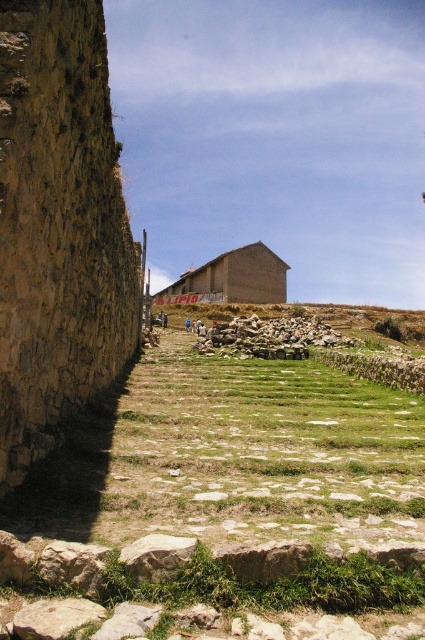
Question: Which object is closer to the camera taking this photo?

Choices:
 (A) brown brick hut at center
 (B) rustic stone wall at center

Answer: (B)

Question: Which object appears farthest from the camera in this image?

Choices:
 (A) brown brick hut at center
 (B) brown rough rock at lower center
 (C) rustic stone wall at center

Answer: (A)

Question: Is brown brick hut at center below rustic stone wall at center?

Choices:
 (A) yes
 (B) no

Answer: (B)

Question: Can you confirm if rustic stone wall at center is positioned to the right of brown rough rock at lower center?

Choices:
 (A) no
 (B) yes

Answer: (B)

Question: Is brown brick hut at center to the left of rustic stone wall at center from the viewer's perspective?

Choices:
 (A) no
 (B) yes

Answer: (B)

Question: Among these points, which one is nearest to the camera?

Choices:
 (A) (195, 538)
 (B) (232, 259)
 (C) (255, 355)

Answer: (A)